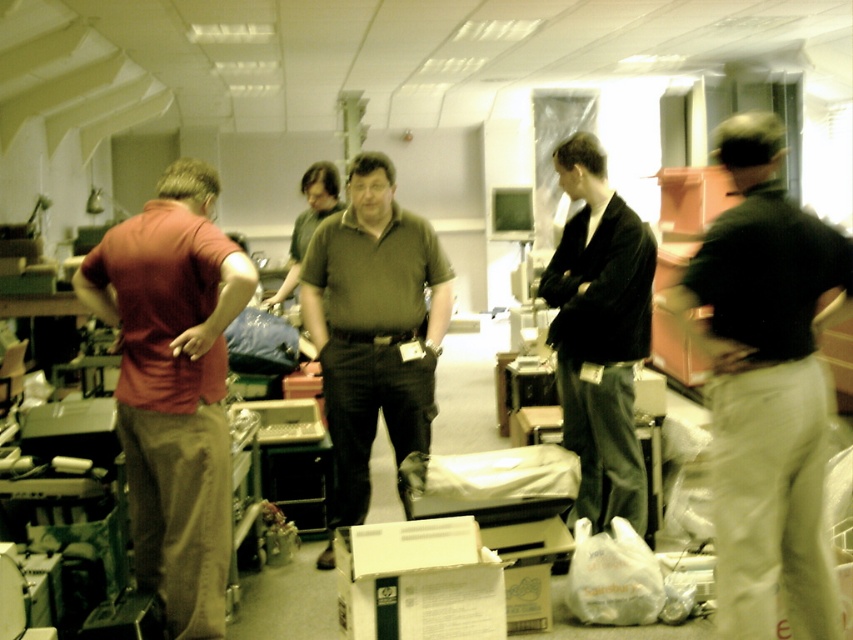
You are a delivery person trying to hand a package to the recipient. You see the matte red shirt at left and the dark gray suit at center. Which person should you approach based on their proximity to you?

The dark gray suit at center is closer to you than the matte red shirt at left, so you should approach the dark gray suit at center first since they are only 4.76 feet away.

Please look at the image. There is a point at coordinate [601,333]. What object in the scene is located at this coordinate?

The dark gray suit at center is located at coordinate [601,333].

In the image, there is a point at coordinates [766,387]. Which object from the list corresponds to this point?

The point at coordinates [766,387] corresponds to the black cotton shirt at right.